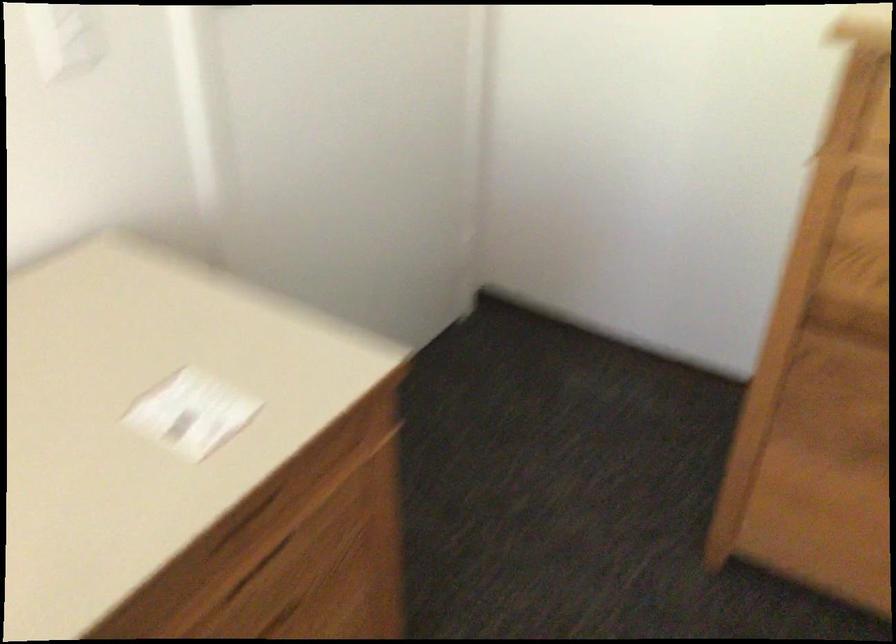
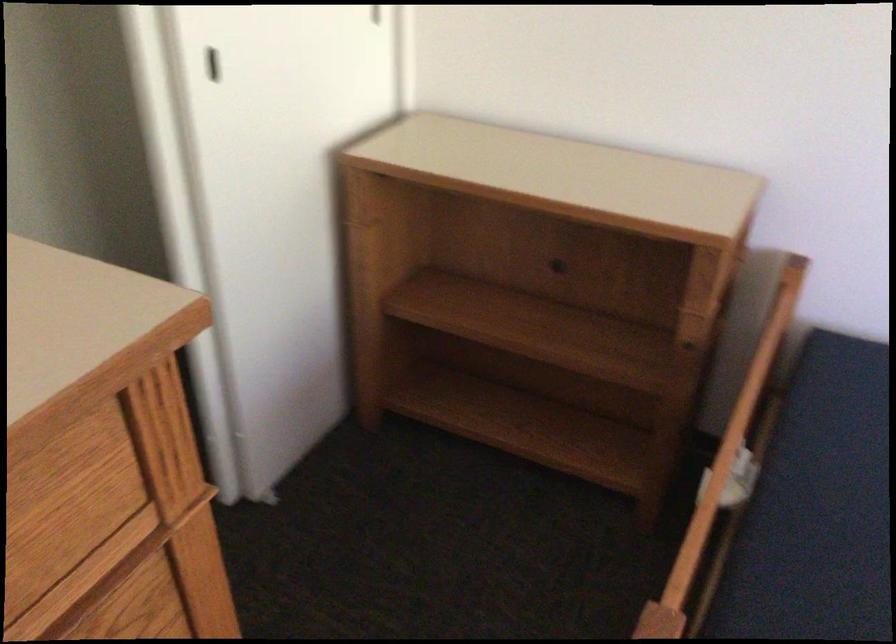
How did the camera likely rotate?

The rotation direction of the camera is right-down.